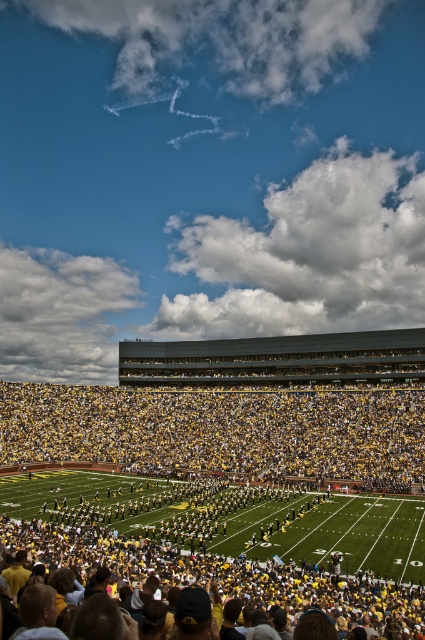
In the scene shown: Based on the coordinates provided, what is located at point (x=226, y=496) in the stadium scene?

The point (x=226, y=496) corresponds to the yellow green uniformed band at center.